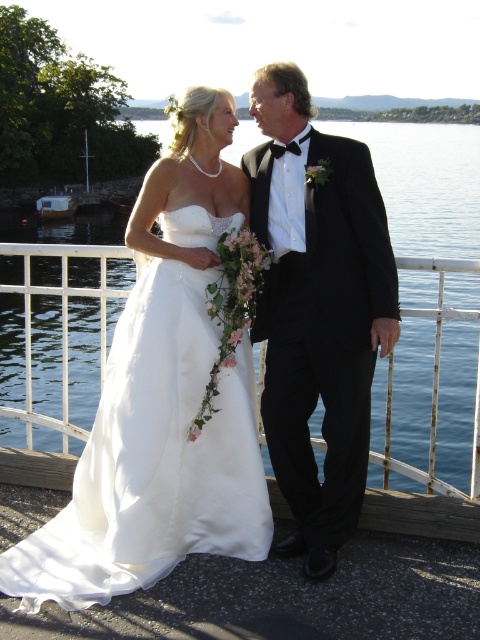
You are a photographer trying to capture the couple in the center of the image. The black satin tuxedo at center and the white metal railing at center are both in the frame. Which object is narrower in width?

The black satin tuxedo at center is narrower in width compared to the white metal railing at center.